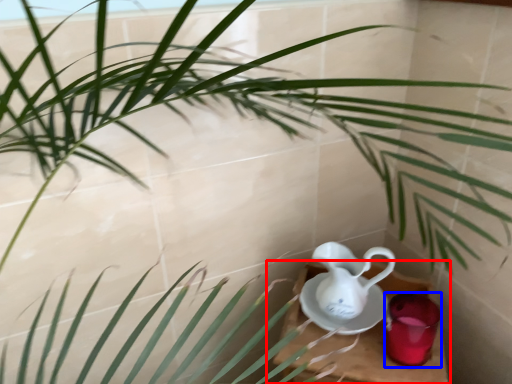
Question: Which object is closer to the camera taking this photo, table (highlighted by a red box) or tableware (highlighted by a blue box)?

Choices:
 (A) table
 (B) tableware

Answer: (A)